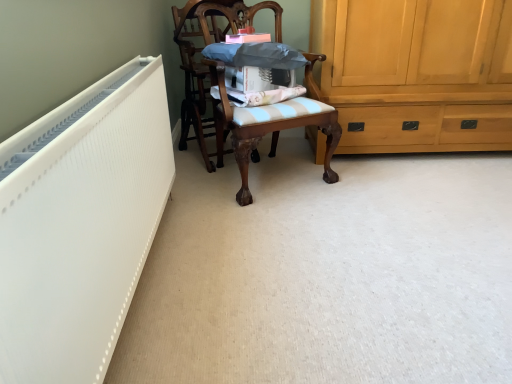
Image resolution: width=512 pixels, height=384 pixels. What do you see at coordinates (199, 57) in the screenshot?
I see `wooden chair at center, which appears as the 2th chair when viewed from the right` at bounding box center [199, 57].

What is the approximate width of white textured radiator at left?

white textured radiator at left is 16.92 centimeters wide.

In order to face wooden chair at center, the 2th chair when ordered from left to right, should I rotate leftwards or rightwards?

You should look right and rotate roughly 1.390 degrees.

The width and height of the screenshot is (512, 384). What are the coordinates of `wooden chair at center, which appears as the 2th chair when viewed from the right` in the screenshot? It's located at (199, 57).

Is there a large distance between wooden chair at center, marked as the 1th chair in a left-to-right arrangement, and white textured radiator at left?

That's right, there is a large distance between wooden chair at center, marked as the 1th chair in a left-to-right arrangement, and white textured radiator at left.

Does wooden chair at center, marked as the 1th chair in a left-to-right arrangement, turn towards white textured radiator at left?

No, wooden chair at center, marked as the 1th chair in a left-to-right arrangement, does not turn towards white textured radiator at left.

How different are the orientations of wooden chair at center, marked as the 1th chair in a left-to-right arrangement, and white textured radiator at left in degrees?

The facing directions of wooden chair at center, marked as the 1th chair in a left-to-right arrangement, and white textured radiator at left are 56.7 degrees apart.

How far apart are wooden chair at center, which appears as the 2th chair when viewed from the right, and white textured radiator at left?

They are 1.33 meters apart.

In the scene shown: From a real-world perspective, is wooden chair at center, the 2th chair when ordered from left to right, physically below white textured radiator at left?

Actually, wooden chair at center, the 2th chair when ordered from left to right, is physically above white textured radiator at left in the real world.

Based on their sizes in the image, would you say wooden chair at center, the 2th chair when ordered from left to right, is bigger or smaller than white textured radiator at left?

Considering their sizes, wooden chair at center, the 2th chair when ordered from left to right, takes up more space than white textured radiator at left.

Is wooden chair at center, which is the 1th chair in right-to-left order, oriented away from white textured radiator at left?

wooden chair at center, which is the 1th chair in right-to-left order, is not turned away from white textured radiator at left.

Considering the points (223, 66) and (98, 273), which point is in front, point (223, 66) or point (98, 273)?

The point (98, 273) is closer.

Is light brown wood cabinet at right oriented towards wooden chair at center, marked as the 1th chair in a left-to-right arrangement?

No, light brown wood cabinet at right is not oriented towards wooden chair at center, marked as the 1th chair in a left-to-right arrangement.

Which is more to the right, light brown wood cabinet at right or wooden chair at center, which appears as the 2th chair when viewed from the right?

light brown wood cabinet at right.

Image resolution: width=512 pixels, height=384 pixels. I want to click on cabinetry above the wooden chair at center, which appears as the 2th chair when viewed from the right (from the image's perspective), so point(417,72).

From the image's perspective, who appears lower, light brown wood cabinet at right or wooden chair at center, which appears as the 2th chair when viewed from the right?

wooden chair at center, which appears as the 2th chair when viewed from the right, is shown below in the image.

Which object is positioned more to the left, wooden chair at center, marked as the 1th chair in a left-to-right arrangement, or light brown wood cabinet at right?

wooden chair at center, marked as the 1th chair in a left-to-right arrangement.

Is wooden chair at center, marked as the 1th chair in a left-to-right arrangement, positioned in front of light brown wood cabinet at right?

Yes, the depth of wooden chair at center, marked as the 1th chair in a left-to-right arrangement, is less than that of light brown wood cabinet at right.

Is wooden chair at center, marked as the 1th chair in a left-to-right arrangement, with light brown wood cabinet at right?

wooden chair at center, marked as the 1th chair in a left-to-right arrangement, and light brown wood cabinet at right are clearly separated.

Considering the sizes of objects wooden chair at center, which appears as the 2th chair when viewed from the right, and light brown wood cabinet at right in the image provided, who is thinner, wooden chair at center, which appears as the 2th chair when viewed from the right, or light brown wood cabinet at right?

wooden chair at center, which appears as the 2th chair when viewed from the right.

How many degrees apart are the facing directions of wooden chair at center, marked as the 1th chair in a left-to-right arrangement, and wooden chair at center, which is the 1th chair in right-to-left order?

3.02 degrees separate the facing orientations of wooden chair at center, marked as the 1th chair in a left-to-right arrangement, and wooden chair at center, which is the 1th chair in right-to-left order.

Is wooden chair at center, marked as the 1th chair in a left-to-right arrangement, positioned in front of wooden chair at center, which is the 1th chair in right-to-left order?

No, it is behind wooden chair at center, which is the 1th chair in right-to-left order.

From a real-world perspective, is wooden chair at center, which appears as the 2th chair when viewed from the right, positioned above or below wooden chair at center, the 2th chair when ordered from left to right?

Clearly, from a real-world perspective, wooden chair at center, which appears as the 2th chair when viewed from the right, is above wooden chair at center, the 2th chair when ordered from left to right.

Locate an element on the screen. chair that appears above the wooden chair at center, which is the 1th chair in right-to-left order (from the image's perspective) is located at coordinates (199, 57).

From the image's perspective, is white textured radiator at left positioned above or below wooden chair at center, marked as the 1th chair in a left-to-right arrangement?

From the image's perspective, white textured radiator at left appears below wooden chair at center, marked as the 1th chair in a left-to-right arrangement.

Find the location of `the 2nd chair above the white textured radiator at left (from the image's perspective)`. the 2nd chair above the white textured radiator at left (from the image's perspective) is located at coordinates (199, 57).

Is white textured radiator at left to the left of wooden chair at center, marked as the 1th chair in a left-to-right arrangement, from the viewer's perspective?

Correct, you'll find white textured radiator at left to the left of wooden chair at center, marked as the 1th chair in a left-to-right arrangement.

What's the angular difference between white textured radiator at left and wooden chair at center, which appears as the 2th chair when viewed from the right,'s facing directions?

The angle between the facing direction of white textured radiator at left and the facing direction of wooden chair at center, which appears as the 2th chair when viewed from the right, is 56.7 degrees.

Consider the image. From the image's perspective, is wooden chair at center, the 2th chair when ordered from left to right, above or below blue striped fabric at center?

wooden chair at center, the 2th chair when ordered from left to right, is situated lower than blue striped fabric at center in the image.

Is wooden chair at center, the 2th chair when ordered from left to right, beside blue striped fabric at center?

No, wooden chair at center, the 2th chair when ordered from left to right, is not making contact with blue striped fabric at center.

Could you tell me if wooden chair at center, which is the 1th chair in right-to-left order, is facing blue striped fabric at center?

Yes.

Identify the location of radiator on the left side of wooden chair at center, which appears as the 2th chair when viewed from the right. Image resolution: width=512 pixels, height=384 pixels. pos(80,224).

The height and width of the screenshot is (384, 512). In order to click on chair that is the 1st one above the white textured radiator at left (from a real-world perspective) in this screenshot , I will do `click(272, 131)`.

When comparing their distances from white textured radiator at left, does wooden chair at center, the 2th chair when ordered from left to right, or light brown wood cabinet at right seem further?

light brown wood cabinet at right is further to white textured radiator at left.

In the scene shown: Looking at the image, which one is located closer to wooden chair at center, which appears as the 2th chair when viewed from the right, light brown wood cabinet at right or white textured radiator at left?

light brown wood cabinet at right.

Considering their positions, is white textured radiator at left positioned further to light brown wood cabinet at right than blue striped fabric at center?

Based on the image, white textured radiator at left appears to be further to light brown wood cabinet at right.

Based on their spatial positions, is wooden chair at center, marked as the 1th chair in a left-to-right arrangement, or white textured radiator at left further from light brown wood cabinet at right?

white textured radiator at left.

Which object lies nearer to the anchor point blue striped fabric at center, light brown wood cabinet at right or wooden chair at center, which is the 1th chair in right-to-left order?

wooden chair at center, which is the 1th chair in right-to-left order, lies closer to blue striped fabric at center than the other object.

In the scene shown: Looking at the image, which one is located closer to wooden chair at center, the 2th chair when ordered from left to right, light brown wood cabinet at right or white textured radiator at left?

Among the two, light brown wood cabinet at right is located nearer to wooden chair at center, the 2th chair when ordered from left to right.

Looking at the image, which one is located closer to blue striped fabric at center, light brown wood cabinet at right or white textured radiator at left?

light brown wood cabinet at right is closer to blue striped fabric at center.

Looking at the image, which one is located closer to blue striped fabric at center, wooden chair at center, marked as the 1th chair in a left-to-right arrangement, or light brown wood cabinet at right?

wooden chair at center, marked as the 1th chair in a left-to-right arrangement, is positioned closer to the anchor blue striped fabric at center.

The width and height of the screenshot is (512, 384). In order to click on chair between wooden chair at center, marked as the 1th chair in a left-to-right arrangement, and light brown wood cabinet at right in this screenshot , I will do `click(272, 131)`.

You are a GUI agent. You are given a task and a screenshot of the screen. Output one action in this format:
    pyautogui.click(x=<x>, y=<y>)
    Task: Click on the fabric positioned between white textured radiator at left and wooden chair at center, marked as the 1th chair in a left-to-right arrangement, from near to far
    
    Given the screenshot: What is the action you would take?
    pos(263,96)

The image size is (512, 384). Find the location of `chair located between white textured radiator at left and wooden chair at center, which appears as the 2th chair when viewed from the right, in the depth direction`. chair located between white textured radiator at left and wooden chair at center, which appears as the 2th chair when viewed from the right, in the depth direction is located at coordinates (272, 131).

In order to click on fabric between wooden chair at center, the 2th chair when ordered from left to right, and wooden chair at center, which appears as the 2th chair when viewed from the right, in the front-back direction in this screenshot , I will do `click(263, 96)`.